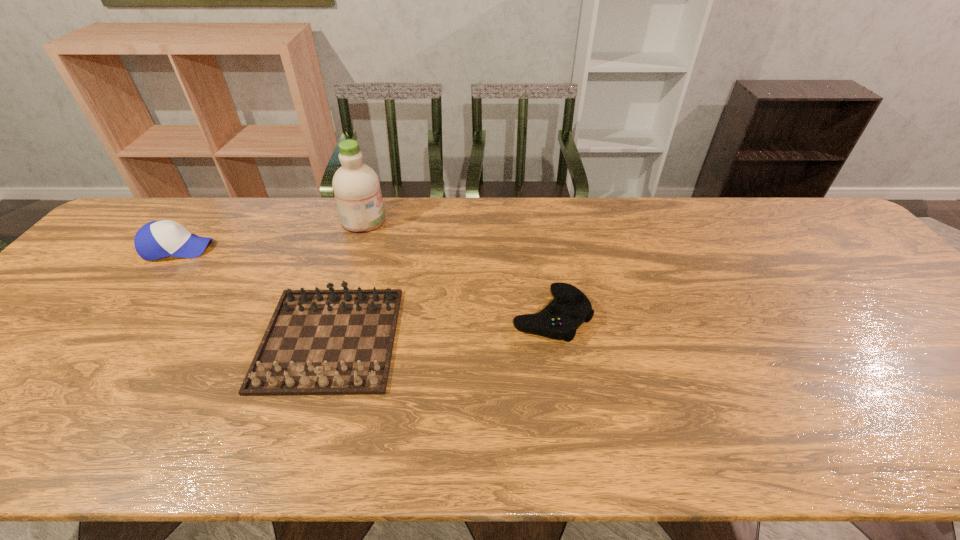
The image size is (960, 540). I want to click on cleansing agent positioned at the far edge, so click(x=356, y=186).

Locate an element on the screen. The width and height of the screenshot is (960, 540). baseball cap located at the far edge is located at coordinates (157, 239).

You are a GUI agent. You are given a task and a screenshot of the screen. Output one action in this format:
    pyautogui.click(x=<x>, y=<y>)
    Task: Click on the object located at the left edge
    
    Given the screenshot: What is the action you would take?
    pyautogui.click(x=157, y=239)

The image size is (960, 540). What are the coordinates of `object present at the far left corner` in the screenshot? It's located at (157, 239).

The height and width of the screenshot is (540, 960). What are the coordinates of `vacant position at the far edge of the desktop` in the screenshot? It's located at (560, 222).

At what (x,y) coordinates should I click in order to perform the action: click on vacant space at the near edge of the desktop. Please return your answer as a coordinate pair (x, y). Looking at the image, I should click on (324, 429).

Locate an element on the screen. vacant space at the left edge is located at coordinates (98, 301).

Find the location of a particular element. vacant region at the right edge is located at coordinates (908, 318).

Identify the location of vacant space at the far left corner. Image resolution: width=960 pixels, height=540 pixels. (172, 207).

Image resolution: width=960 pixels, height=540 pixels. What are the coordinates of `vacant area that lies between the third shortest object and the chessboard` in the screenshot? It's located at (253, 293).